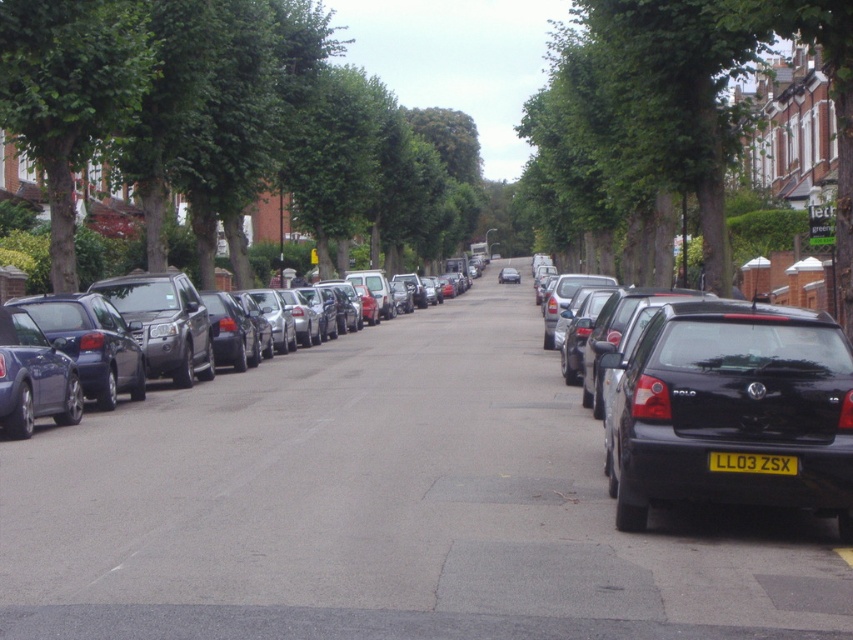
You are a delivery driver who needs to park your van between the green leafy tree at left and the black glossy car at right. Can your van, which is 2 meters wide, fit in the space between them?

The green leafy tree at left is wider than the black glossy car at right. However, the description only provides information about their widths but does not specify the distance between them. Without knowing the exact space between the two objects, it is impossible to determine if the van can fit.

You are a delivery drone flying at an altitude of 20 meters above the residential street. You need to land at the point marked as point (54, 124). Is your current altitude safe enough to land there without crashing into any obstacles?

The point (54, 124) is 19.25 meters away from the camera. Since the drone is flying at 20 meters altitude, it is safe to land as the altitude is slightly higher than the distance to the landing point, ensuring clearance from obstacles.

You are a delivery driver who needs to park your car, which is as long as the shiny metallic car at center. There is a parking spot next to the green leafy tree at upper left. Can your car fit in that spot?

Result: The green leafy tree at upper left is smaller than the shiny metallic car at center. Since your car is as long as the shiny metallic car at center, it may not fit in the parking spot next to the smaller green leafy tree at upper left, as the spot might be sized for smaller vehicles.